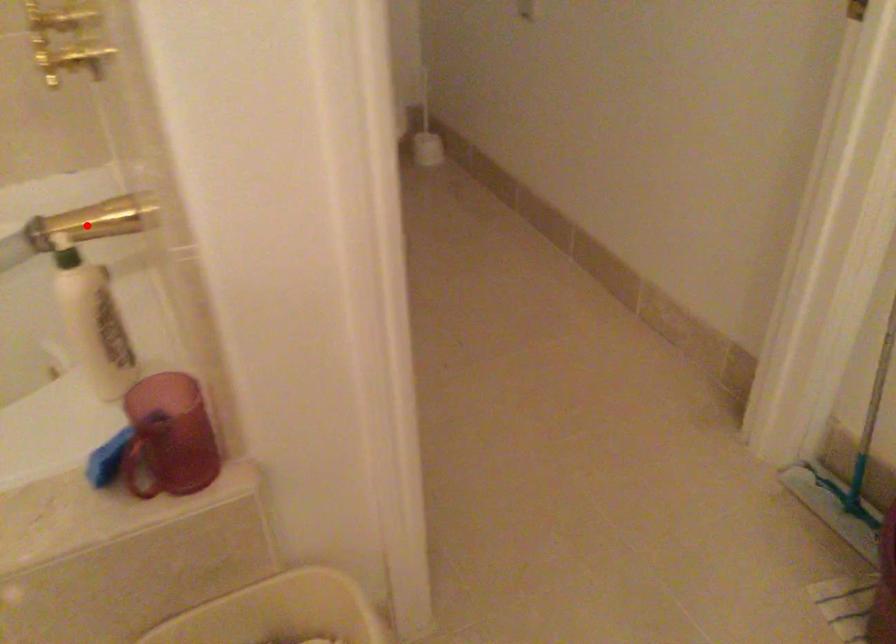
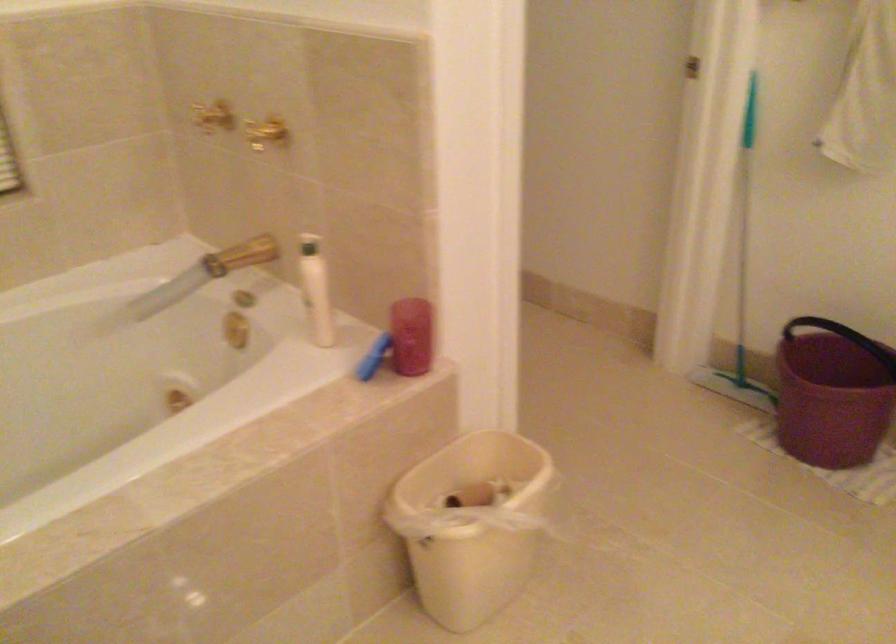
Question: I am providing you with two images of the same scene from different viewpoints. A red point is shown in image1. For the corresponding object point in image2, is it positioned nearer or farther from the camera?

Choices:
 (A) Nearer
 (B) Farther

Answer: (B)